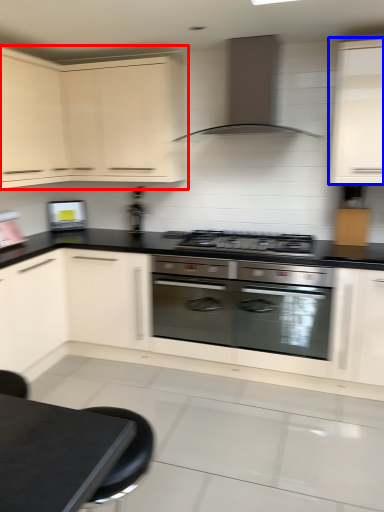
Question: Which object is closer to the camera taking this photo, cabinetry (highlighted by a red box) or cabinetry (highlighted by a blue box)?

Choices:
 (A) cabinetry
 (B) cabinetry

Answer: (B)